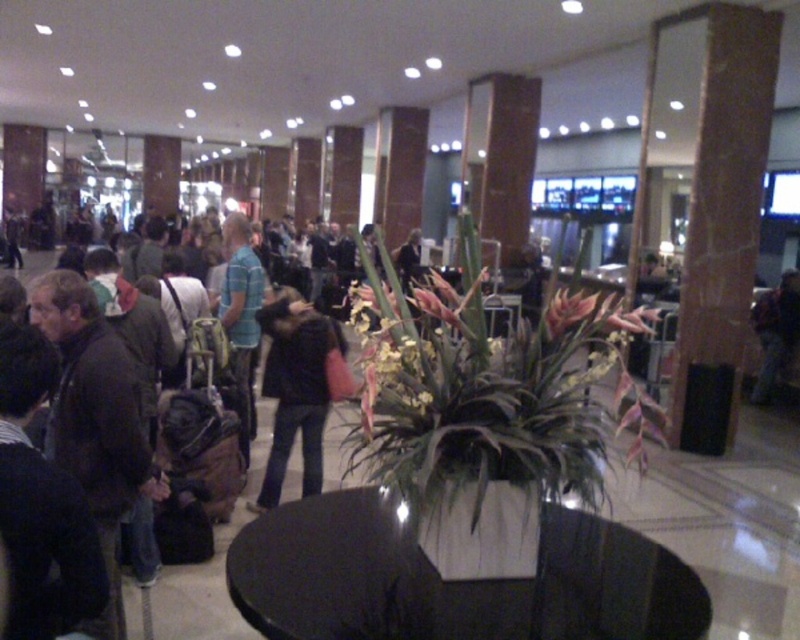
Question: Does black glossy table at center appear on the right side of dark blue jeans at center?

Choices:
 (A) yes
 (B) no

Answer: (B)

Question: Does black glossy table at center have a larger size compared to black leather jacket at center?

Choices:
 (A) yes
 (B) no

Answer: (B)

Question: From the image, what is the correct spatial relationship of green leafy plant at center in relation to pink matte flower at center?

Choices:
 (A) above
 (B) below

Answer: (B)

Question: Which point is closer to the camera taking this photo?

Choices:
 (A) (782, 344)
 (B) (324, 504)

Answer: (B)

Question: Among these objects, which one is farthest from the camera?

Choices:
 (A) pink matte flower at center
 (B) black leather jacket at center
 (C) black glossy table at center
 (D) dark blue jeans at center

Answer: (D)

Question: Among these objects, which one is nearest to the camera?

Choices:
 (A) black glossy table at center
 (B) black leather jacket at center
 (C) green leafy plant at center

Answer: (A)